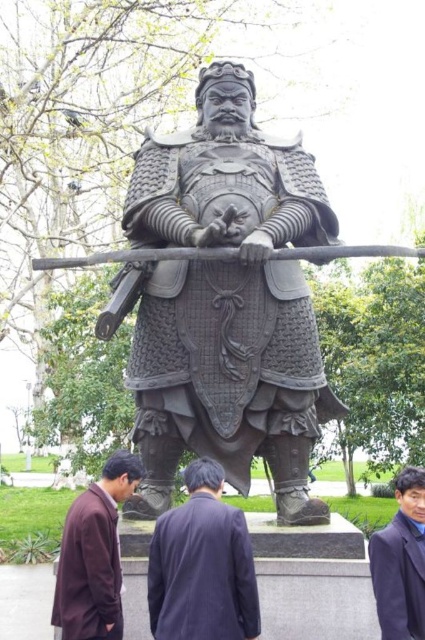
Question: Based on their relative distances, which object is farther from the dark brown fabric coat at center?

Choices:
 (A) black polished armor at center
 (B) brown matte jacket at lower left

Answer: (A)

Question: Can you confirm if dark brown fabric coat at center is positioned to the right of dark blue woolen robe at lower right?

Choices:
 (A) no
 (B) yes

Answer: (A)

Question: Considering the real-world distances, which object is closest to the black polished armor at center?

Choices:
 (A) brown matte jacket at lower left
 (B) dark brown fabric coat at center

Answer: (A)

Question: Is black polished armor at center bigger than dark brown fabric coat at center?

Choices:
 (A) no
 (B) yes

Answer: (B)

Question: Which is farther from the dark blue woolen robe at lower right?

Choices:
 (A) black polished armor at center
 (B) brown matte jacket at lower left
 (C) dark brown fabric coat at center

Answer: (A)

Question: Does black polished armor at center come behind brown matte jacket at lower left?

Choices:
 (A) yes
 (B) no

Answer: (A)